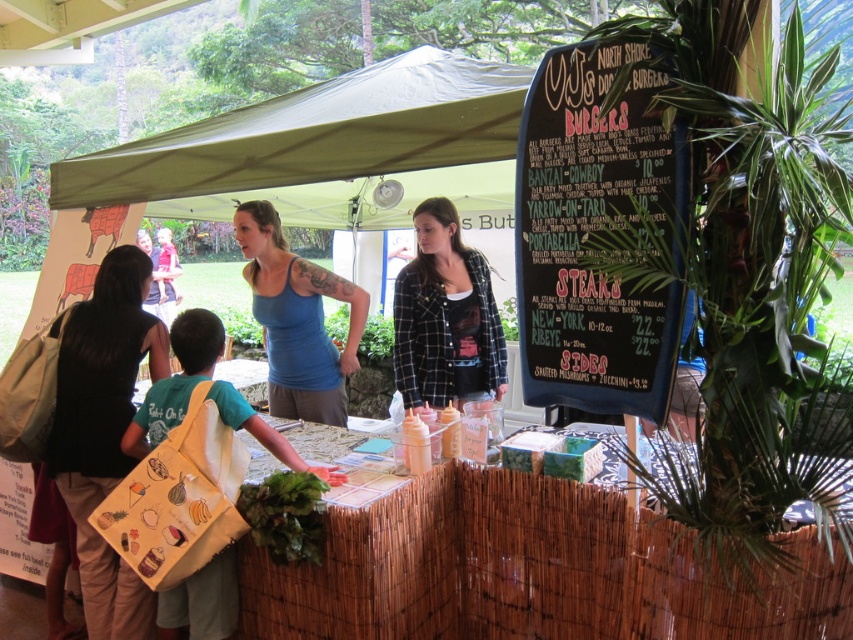
Is blue matte tank top at center bigger than yellow fabric bag at center?

Correct, blue matte tank top at center is larger in size than yellow fabric bag at center.

Who is taller, blue matte tank top at center or yellow fabric bag at center?

blue matte tank top at center is taller.

The width and height of the screenshot is (853, 640). Describe the element at coordinates (297, 320) in the screenshot. I see `blue matte tank top at center` at that location.

You are a GUI agent. You are given a task and a screenshot of the screen. Output one action in this format:
    pyautogui.click(x=<x>, y=<y>)
    Task: Click on the blue matte tank top at center
    
    Given the screenshot: What is the action you would take?
    pyautogui.click(x=297, y=320)

Does black fabric bag at lower left come behind black plaid shirt at center?

No, black fabric bag at lower left is closer to the viewer.

Does point (126, 392) lie in front of point (502, 392)?

Yes, point (126, 392) is closer to viewer.

In order to click on black fabric bag at lower left in this screenshot , I will do point(103,432).

Can you confirm if black fabric bag at lower left is bigger than yellow fabric bag at center?

Correct, black fabric bag at lower left is larger in size than yellow fabric bag at center.

From the picture: Who is positioned more to the left, black fabric bag at lower left or yellow fabric bag at center?

From the viewer's perspective, black fabric bag at lower left appears more on the left side.

Does point (112, 280) come closer to viewer compared to point (120, 444)?

No, it is behind (120, 444).

Identify the location of black fabric bag at lower left. (103, 432).